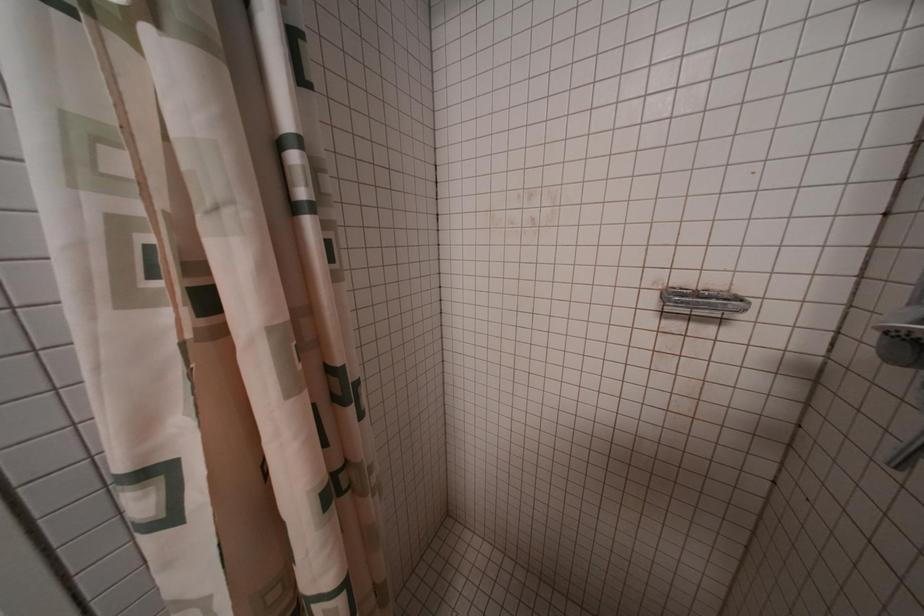
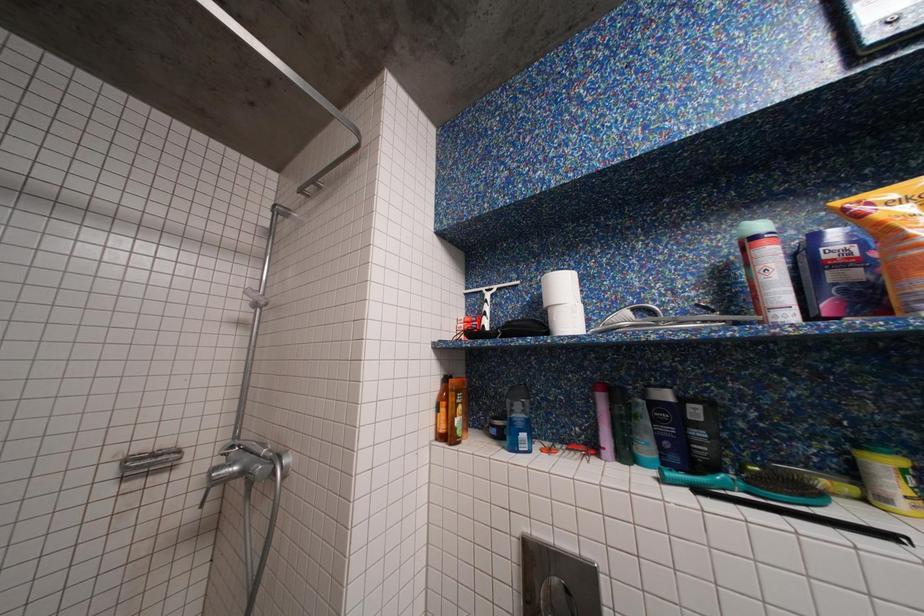
Question: The images are taken continuously from a first-person perspective. In which direction is your viewpoint rotating?

Choices:
 (A) Left
 (B) Right
 (C) Up
 (D) Down

Answer: (B)